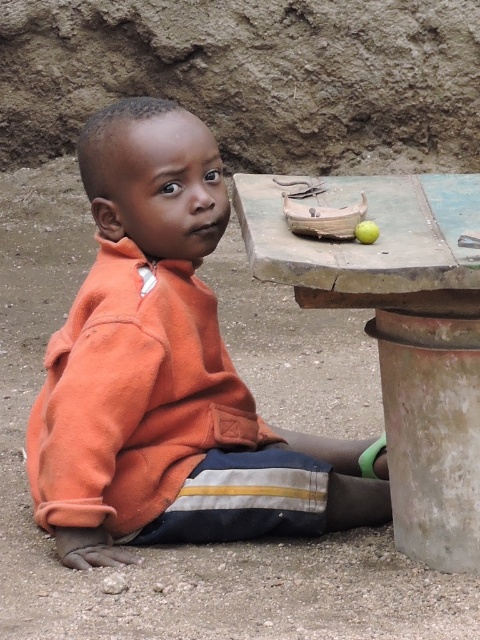
You are a delivery person who needs to leave a package for a child wearing an orange fleece jacket at center. The package must be placed exactly at the coordinates provided. Where should you place the package?

You should place the package at the coordinates point (168,374) where the orange fleece jacket at center is located.

You are a photographer trying to capture the orange fleece jacket at center and the green matte apple at upper center in the same frame. Based on their positions, which object should you adjust your camera to focus on first if you want to include both in your shot?

The orange fleece jacket at center is to the left of the green matte apple at upper center, so you should focus on the orange fleece jacket at center first to ensure both objects are in frame.